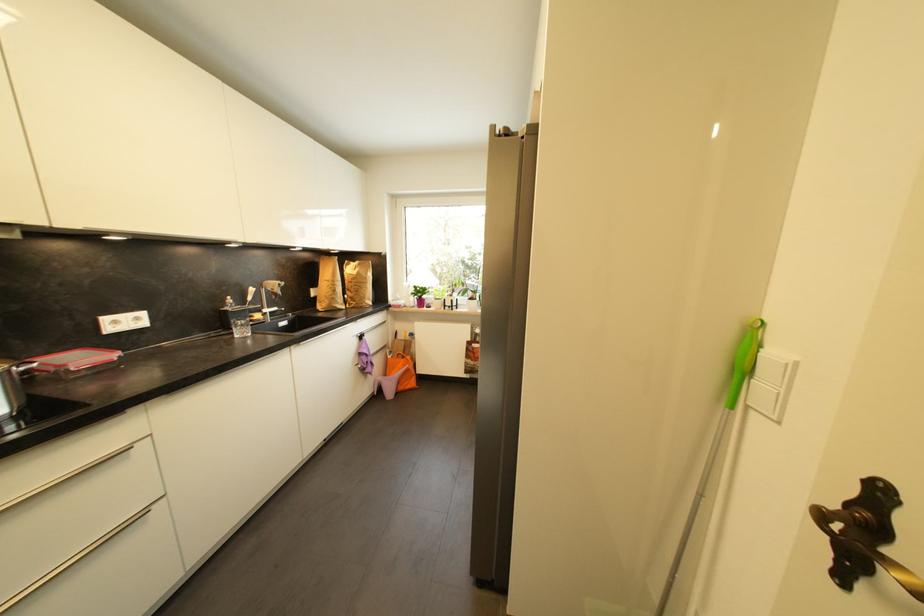
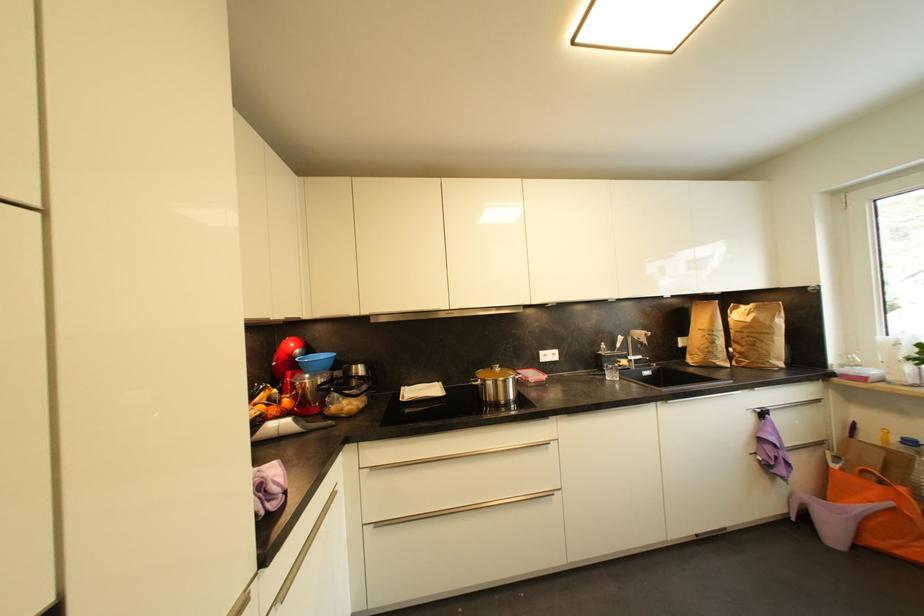
Find the pixel in the second image that matches (247,334) in the first image.

(616, 378)